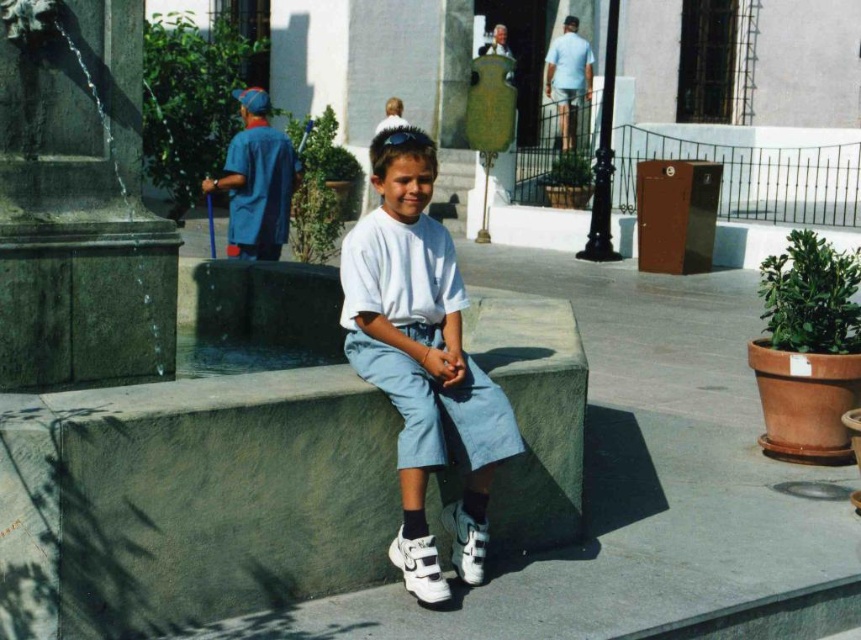
You are standing in the plaza and want to take a photo of the boy. Which object, the white matte shorts at center or the white suede sneaker at lower center, is positioned closer to the camera?

The white matte shorts at center is closer to the viewer than the white suede sneaker at lower center, so the white matte shorts at center will appear closer in the photo.